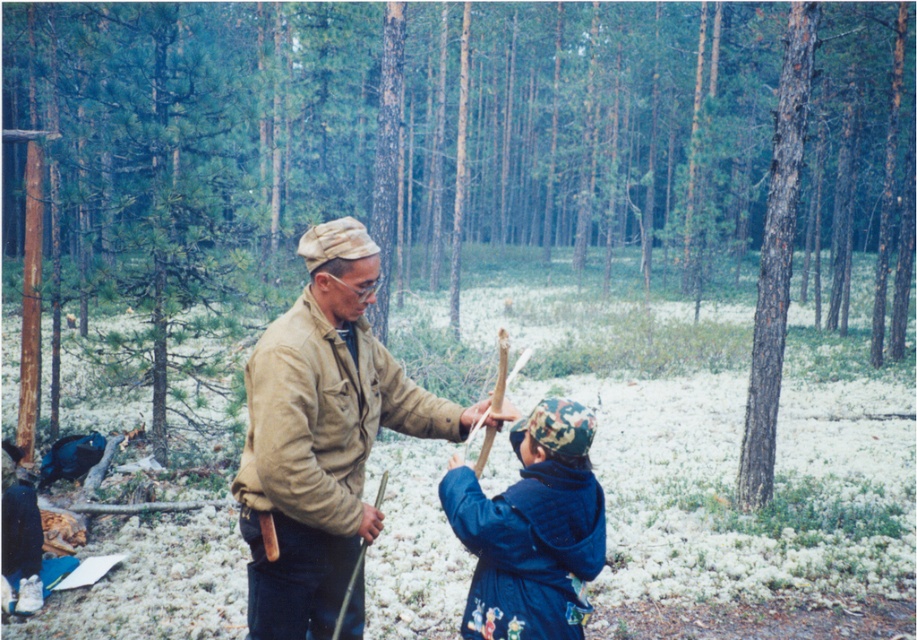
Question: Does tan fabric jacket at center have a smaller size compared to camouflage fabric hat at center?

Choices:
 (A) yes
 (B) no

Answer: (B)

Question: Is tan fabric jacket at center positioned before camouflage fabric hat at center?

Choices:
 (A) yes
 (B) no

Answer: (B)

Question: Where is tan fabric jacket at center located in relation to camouflage fabric hat at center in the image?

Choices:
 (A) right
 (B) left

Answer: (B)

Question: Which point is closer to the camera taking this photo?

Choices:
 (A) (523, 545)
 (B) (362, 348)

Answer: (A)